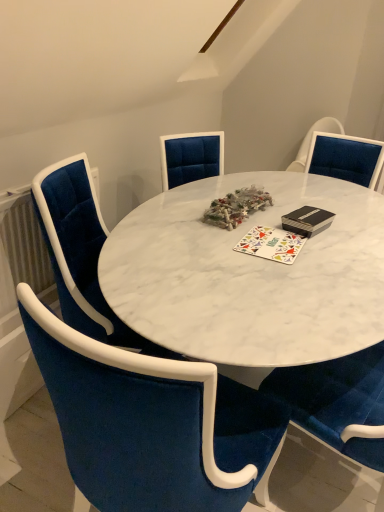
This screenshot has height=512, width=384. What are the coordinates of `free space in front of multicolored fabric mat at center` in the screenshot? It's located at (271, 270).